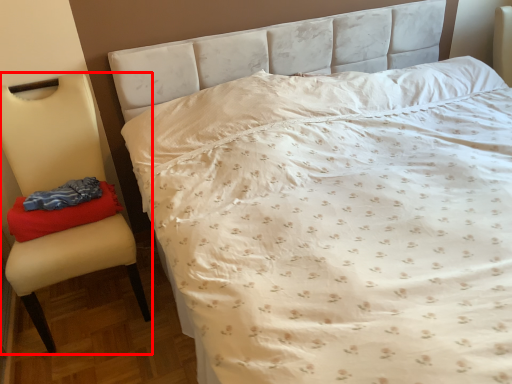
Question: Observing the image, what is the correct spatial positioning of chair (annotated by the red box) in reference to material?

Choices:
 (A) right
 (B) left

Answer: (B)